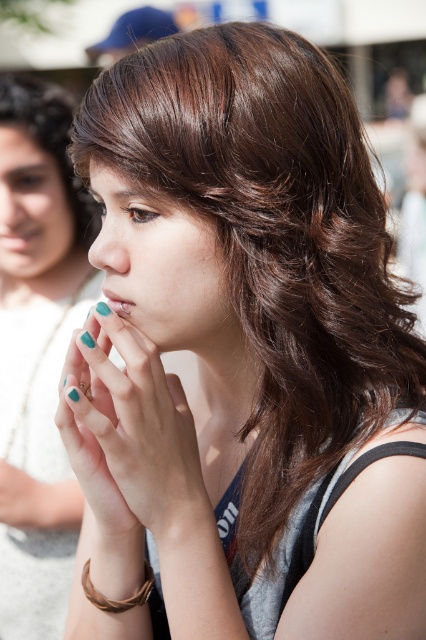
You are a fashion designer observing the image. You need to determine the spatial relationship between the brown woven bracelet at lower left and the teal matte nails at lower left. Which object is positioned higher up when viewed from the observer?

The brown woven bracelet at lower left is taller than teal matte nails at lower left, so the brown woven bracelet at lower left is positioned higher up.

You are standing in the scene and want to move from the point at coordinates point (x=31, y=109) to the point at coordinates point (x=97, y=592). Which direction should you move to get closer to the latter?

You should move away from the viewer because point (x=97, y=592) is further away than point (x=31, y=109).

You are a photographer setting up for a close portrait. You need to ensure that both the teal matte nails at left and the brown woven bracelet at lower left are in focus. Given that your camera can only sharply focus on objects within a 1 meter range, will both items be in focus?

The teal matte nails at left and brown woven bracelet at lower left are 1.11 meters apart from each other. Since the distance between them exceeds the camera focus range of 1 meter, both items cannot be in focus simultaneously.